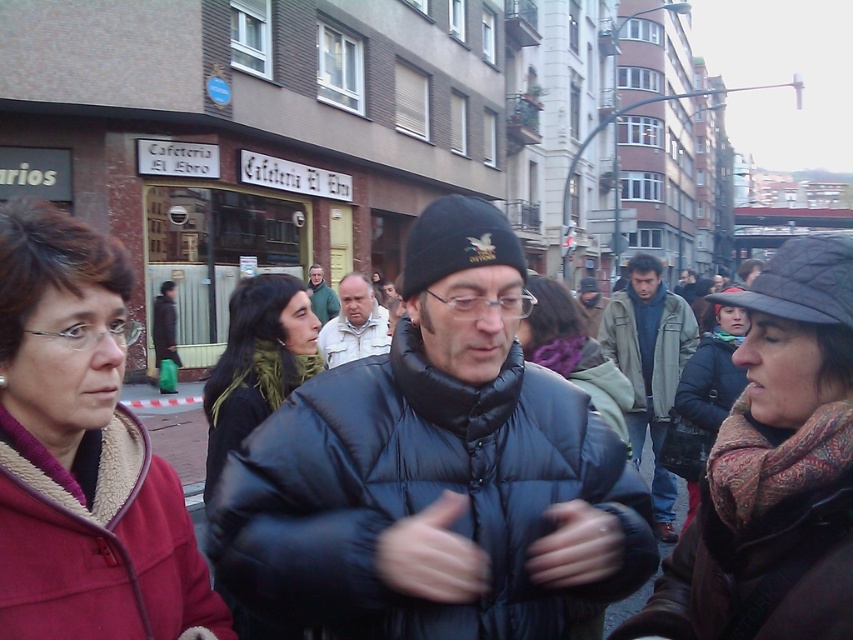
You are a photographer trying to capture both the green scarf at center and the patterned scarf at center in a single shot. Which scarf should you focus on first to ensure both are in frame?

The green scarf at center is closer to the viewer than the patterned scarf at center, so focusing on the green scarf at center first will help ensure both are in frame.

You are a photographer standing 2 meters away from the green scarf at center. You want to take a photo of the camera that is 3.36 meters away from the green scarf. Can you reach the camera from your current position without moving closer to the green scarf?

The distance between you and the camera is 1.36 meters because you are 2 meters away from the green scarf and the camera is 3.36 meters away from the green scarf. Since you can extend your arm or use a camera with a zoom lens, you can reach the camera without moving closer.

You are a fashion designer observing the two scarves in the image. The green scarf at center and the patterned scarf at center. Which one is positioned lower in the scene?

The green scarf at center is positioned lower because it is below the patterned scarf at center.